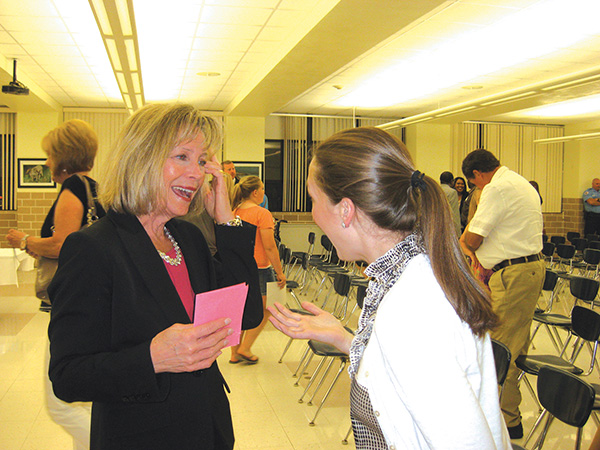
The height and width of the screenshot is (450, 600). What are the coordinates of `black frame` in the screenshot? It's located at (261, 163), (30, 160).